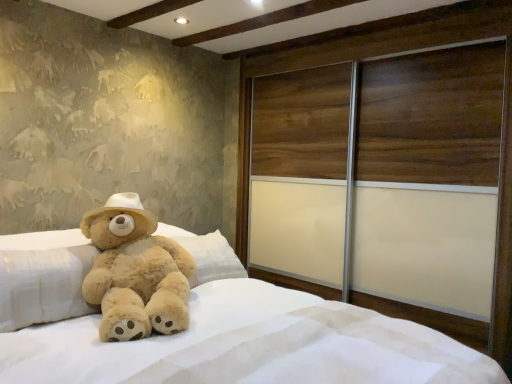
Describe the element at coordinates (429, 178) in the screenshot. The image size is (512, 384). I see `wooden sliding door at right` at that location.

What do you see at coordinates (209, 328) in the screenshot? This screenshot has height=384, width=512. I see `soft plush bear at center` at bounding box center [209, 328].

The height and width of the screenshot is (384, 512). Find the location of `fuzzy beige teddy bear at left`. fuzzy beige teddy bear at left is located at coordinates (135, 272).

Locate an element on the screen. The image size is (512, 384). wooden sliding door at right is located at coordinates (429, 178).

Considering the sizes of objects fuzzy beige teddy bear at left and soft plush bear at center in the image provided, who is bigger, fuzzy beige teddy bear at left or soft plush bear at center?

Bigger between the two is soft plush bear at center.

Do you think fuzzy beige teddy bear at left is within soft plush bear at center, or outside of it?

fuzzy beige teddy bear at left exists entirely within soft plush bear at center.

Could you tell me if fuzzy beige teddy bear at left is turned towards soft plush bear at center?

Yes, fuzzy beige teddy bear at left is aimed at soft plush bear at center.

Could you tell me if soft plush bear at center is facing wooden sliding door at right?

No, soft plush bear at center is not oriented towards wooden sliding door at right.

Considering the points (322, 337) and (333, 109), which point is behind, point (322, 337) or point (333, 109)?

The point (333, 109) is more distant.

From the image's perspective, is soft plush bear at center located above or below wooden sliding door at right?

Based on their image positions, soft plush bear at center is located beneath wooden sliding door at right.

Can you tell me how much soft plush bear at center and wooden sliding door at right differ in facing direction?

87.5 degrees separate the facing orientations of soft plush bear at center and wooden sliding door at right.

What's the angular difference between soft plush bear at center and fuzzy beige teddy bear at left's facing directions?

soft plush bear at center and fuzzy beige teddy bear at left are facing 23.3 degrees away from each other.

Is soft plush bear at center positioned far away from fuzzy beige teddy bear at left?

Actually, soft plush bear at center and fuzzy beige teddy bear at left are a little close together.

Find the location of a particular element. bed below the fuzzy beige teddy bear at left (from a real-world perspective) is located at coordinates click(x=209, y=328).

Is fuzzy beige teddy bear at left inside soft plush bear at center?

Absolutely, fuzzy beige teddy bear at left is inside soft plush bear at center.

In the scene shown: Is fuzzy beige teddy bear at left at the back of wooden sliding door at right?

No, wooden sliding door at right is not facing away from fuzzy beige teddy bear at left.

Is wooden sliding door at right located outside fuzzy beige teddy bear at left?

wooden sliding door at right is positioned outside fuzzy beige teddy bear at left.

This screenshot has width=512, height=384. I want to click on teddy bear located below the wooden sliding door at right (from the image's perspective), so tap(135, 272).

Which is in front, point (455, 71) or point (156, 255)?

The point (156, 255) is in front.

Does point (124, 321) appear closer or farther from the camera than point (449, 304)?

Point (124, 321) is closer to the camera than point (449, 304).

Where is `screen door that is behind the fuzzy beige teddy bear at left`? Image resolution: width=512 pixels, height=384 pixels. screen door that is behind the fuzzy beige teddy bear at left is located at coordinates (429, 178).

Is fuzzy beige teddy bear at left inside or outside of wooden sliding door at right?

fuzzy beige teddy bear at left lies outside wooden sliding door at right.

Which is more to the right, fuzzy beige teddy bear at left or wooden sliding door at right?

wooden sliding door at right.

From the image's perspective, does wooden sliding door at right appear lower than soft plush bear at center?

No.

Based on the photo, how distant is wooden sliding door at right from soft plush bear at center?

They are 38.92 inches apart.

Which object is closer to the camera, wooden sliding door at right or soft plush bear at center?

soft plush bear at center is in front.

Between point (260, 163) and point (12, 360), which one is positioned behind?

Positioned behind is point (260, 163).

The image size is (512, 384). Identify the location of bed located on the right of fuzzy beige teddy bear at left. 209,328.

Identify the location of bed in front of the wooden sliding door at right. The image size is (512, 384). [209, 328].

Which object lies further to the anchor point fuzzy beige teddy bear at left, wooden sliding door at right or soft plush bear at center?

wooden sliding door at right is further to fuzzy beige teddy bear at left.

Based on their spatial positions, is wooden sliding door at right or fuzzy beige teddy bear at left closer to soft plush bear at center?

Among the two, fuzzy beige teddy bear at left is located nearer to soft plush bear at center.

Based on their spatial positions, is soft plush bear at center or fuzzy beige teddy bear at left closer to wooden sliding door at right?

Among the two, soft plush bear at center is located nearer to wooden sliding door at right.

Considering their positions, is fuzzy beige teddy bear at left positioned closer to wooden sliding door at right than soft plush bear at center?

soft plush bear at center is closer to wooden sliding door at right.

Which object lies nearer to the anchor point fuzzy beige teddy bear at left, soft plush bear at center or wooden sliding door at right?

soft plush bear at center is positioned closer to the anchor fuzzy beige teddy bear at left.

Based on their spatial positions, is fuzzy beige teddy bear at left or wooden sliding door at right further from soft plush bear at center?

Among the two, wooden sliding door at right is located further to soft plush bear at center.

Identify the location of teddy bear between soft plush bear at center and wooden sliding door at right from front to back. (135, 272).